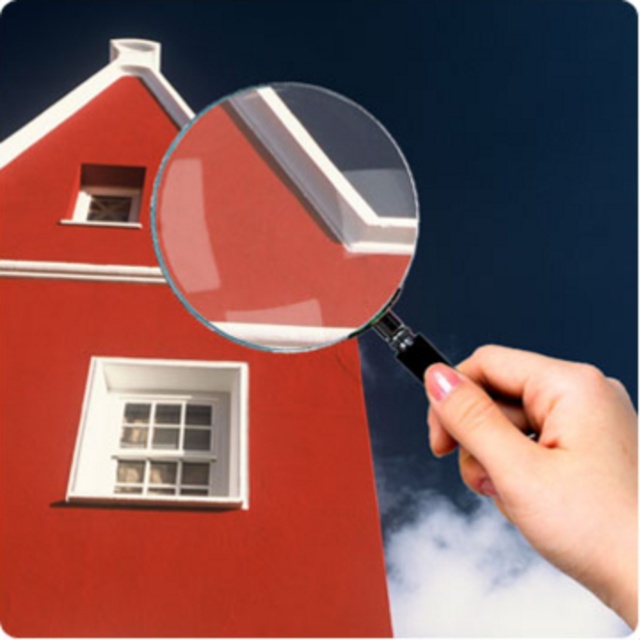
You are examining the red house with white trim through the transparent plastic magnifying glass at upper center and noticing the pink polished fingernails at upper right. Which object is taller?

The transparent plastic magnifying glass at upper center is taller than the pink polished fingernails at upper right according to the description.

You are an inspector examining the red house with white trim. You have a transparent plastic magnifying glass at upper center and pink polished fingernails at upper right. Which object would you use to get a closer look at the small chimney at the peak of the house?

The transparent plastic magnifying glass at upper center has a larger size compared to the pink polished fingernails at upper right, so you should use the transparent plastic magnifying glass at upper center to get a closer look at the small chimney.